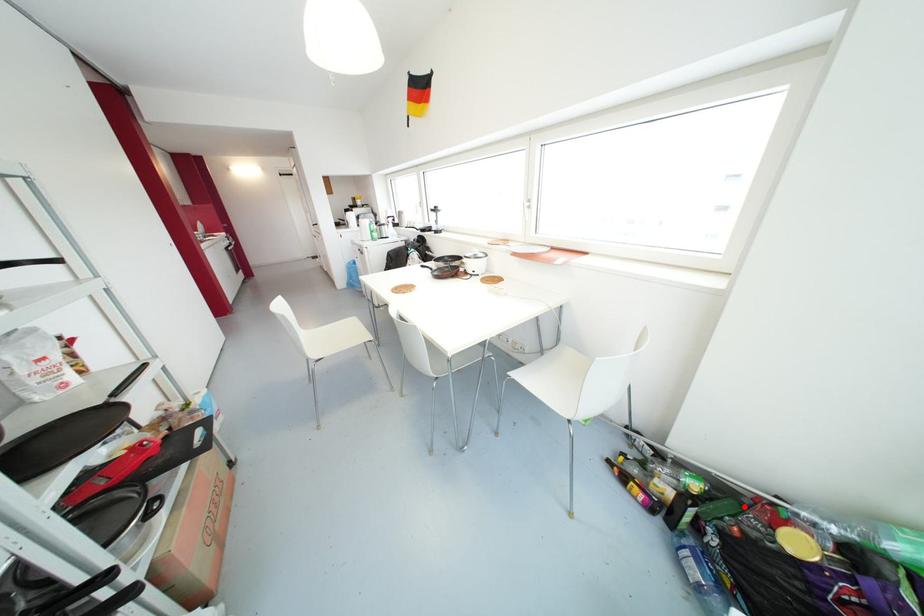
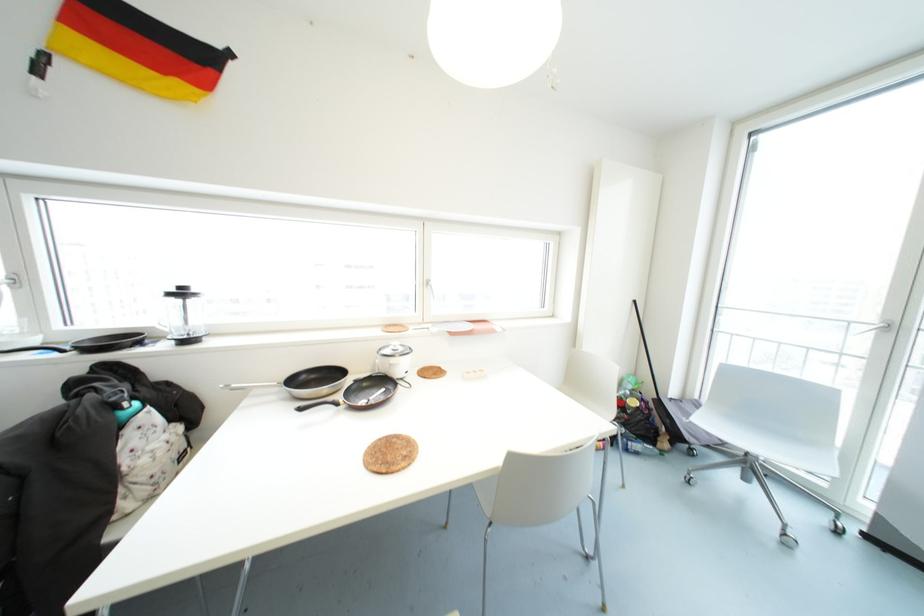
Question: I am providing you with two images of the same scene from different viewpoints. A red point is marked on the first image. At the location where the point appears in image 1, is it still visible in image 2?

Choices:
 (A) Yes
 (B) No

Answer: (B)